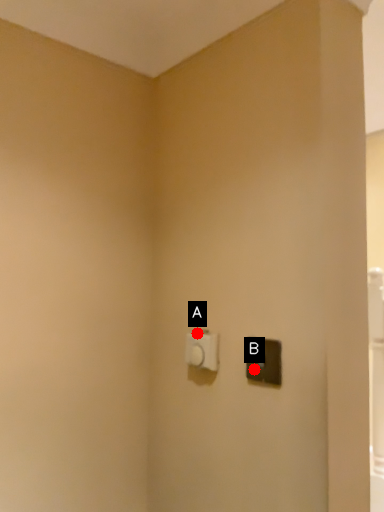
Question: Two points are circled on the image, labeled by A and B beside each circle. Which point is further to the camera?

Choices:
 (A) A is further
 (B) B is further

Answer: (A)